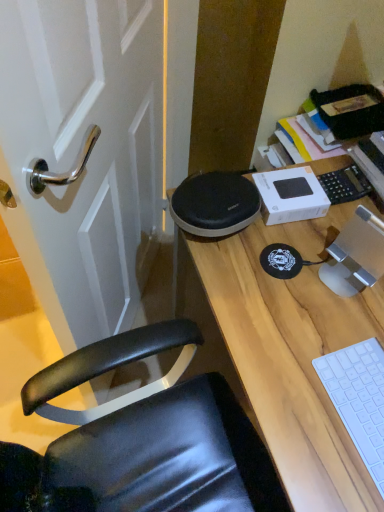
Identify the location of blank area to the left of white plastic keyboard at lower right. click(x=294, y=409).